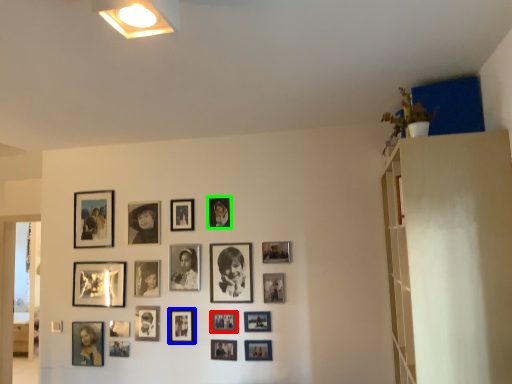
Question: Based on their relative distances, which object is farther from picture frame (highlighted by a red box)? Choose from picture frame (highlighted by a blue box) and picture frame (highlighted by a green box).

Choices:
 (A) picture frame
 (B) picture frame

Answer: (B)